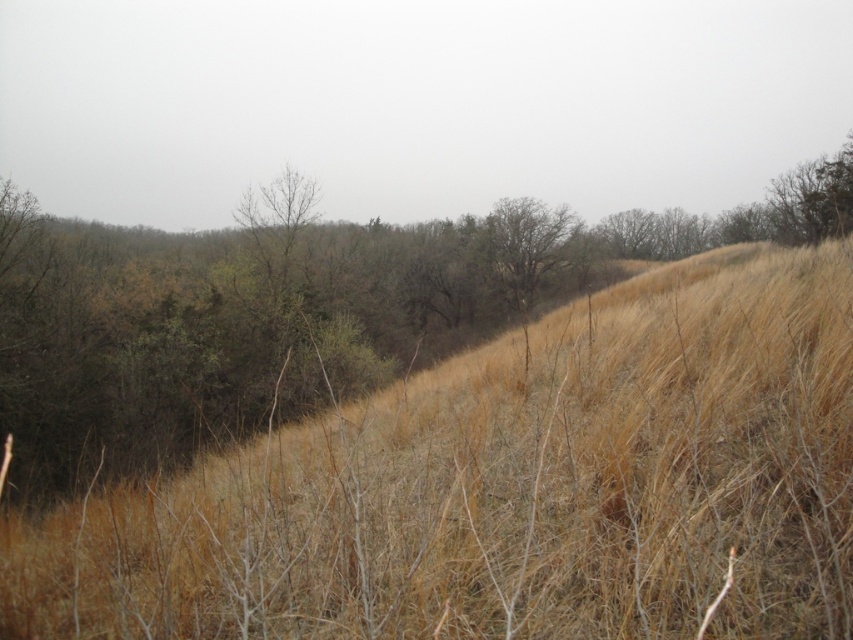
Question: Can you confirm if dry grass at center is positioned below bare wood tree at center?

Choices:
 (A) no
 (B) yes

Answer: (B)

Question: Is dry grass at center bigger than bare wood tree at center?

Choices:
 (A) yes
 (B) no

Answer: (B)

Question: Which of the following is the closest to the observer?

Choices:
 (A) dry grass at center
 (B) bare wood tree at center

Answer: (A)

Question: Does dry grass at center appear under bare wood tree at center?

Choices:
 (A) no
 (B) yes

Answer: (B)